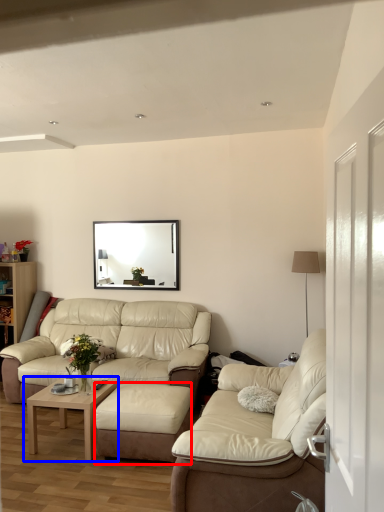
Question: Which of the following is the closest to the observer, footrest (highlighted by a red box) or coffee table (highlighted by a blue box)?

Choices:
 (A) footrest
 (B) coffee table

Answer: (A)